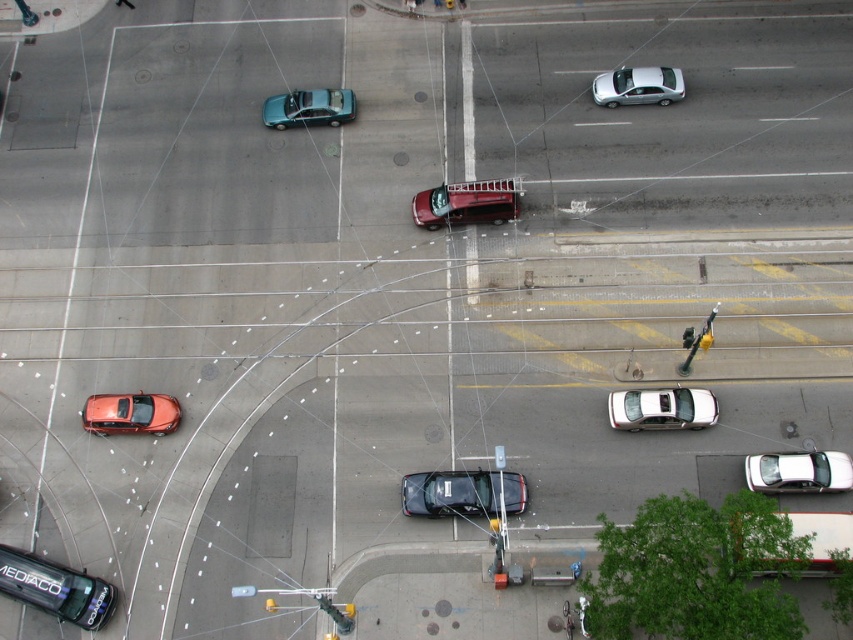
Question: Which point is closer to the camera?

Choices:
 (A) (271, 604)
 (B) (345, 608)

Answer: (A)

Question: Is metallic red fire truck at center behind metallic yellow traffic light at upper center?

Choices:
 (A) yes
 (B) no

Answer: (A)

Question: Which object appears closest to the camera in this image?

Choices:
 (A) metallic green car at upper center
 (B) shiny black sedan at center
 (C) metallic red fire truck at center

Answer: (B)

Question: Does shiny black sedan at center have a larger size compared to metallic red fire truck at center?

Choices:
 (A) yes
 (B) no

Answer: (B)

Question: Which of these objects is positioned farthest from the shiny black sedan at center?

Choices:
 (A) metallic green car at upper center
 (B) white glossy sedan at center-right
 (C) shiny orange car at lower left
 (D) yellow plastic traffic light at upper center

Answer: (A)

Question: Is white matte truck at lower right to the right of metallic yellow traffic light at right from the viewer's perspective?

Choices:
 (A) yes
 (B) no

Answer: (A)